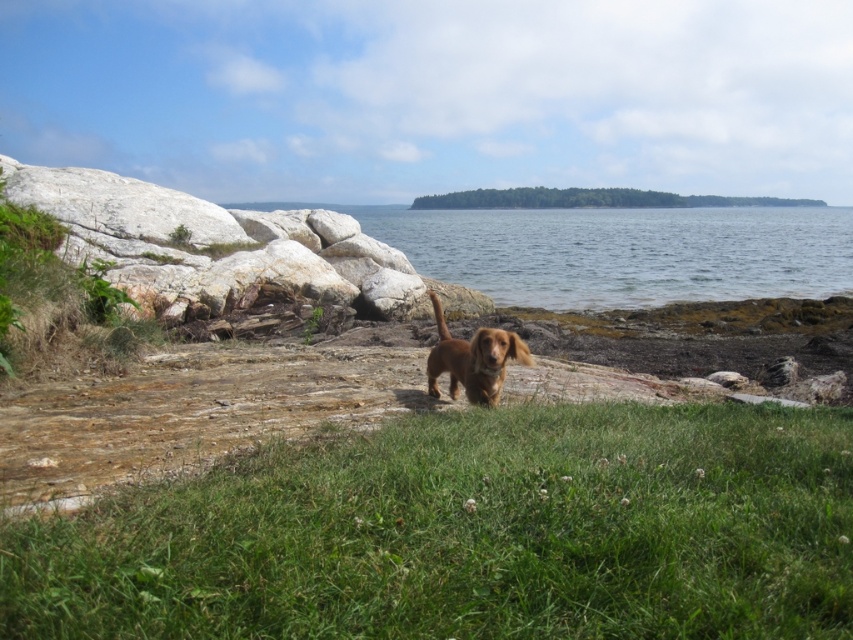
The image size is (853, 640). In order to click on green grassy at center in this screenshot , I will do `click(469, 532)`.

What do you see at coordinates (469, 532) in the screenshot? I see `green grassy at center` at bounding box center [469, 532].

Locate an element on the screen. Image resolution: width=853 pixels, height=640 pixels. green grassy at center is located at coordinates (469, 532).

Can you confirm if green grassy at center is positioned below golden brown fur dog at center?

Yes, green grassy at center is below golden brown fur dog at center.

This screenshot has height=640, width=853. Describe the element at coordinates (469, 532) in the screenshot. I see `green grassy at center` at that location.

Is point (669, 611) closer to camera compared to point (496, 374)?

That is True.

Where is `green grassy at center`? This screenshot has width=853, height=640. green grassy at center is located at coordinates (469, 532).

What do you see at coordinates (619, 252) in the screenshot?
I see `clear water at center` at bounding box center [619, 252].

Who is more forward, (x=844, y=237) or (x=496, y=403)?

Positioned in front is point (x=496, y=403).

At what (x,y) coordinates should I click in order to perform the action: click on clear water at center. Please return your answer as a coordinate pair (x, y). This screenshot has width=853, height=640. Looking at the image, I should click on (619, 252).